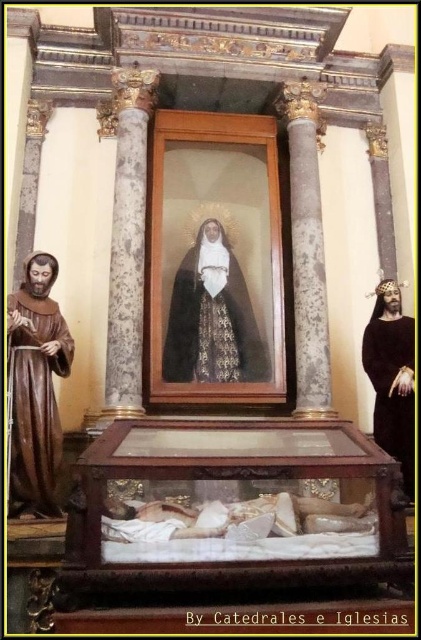
Question: Estimate the real-world distances between objects in this image. Which object is closer to the wooden sarcophagus at center?

Choices:
 (A) black velvet robe at right
 (B) black velvet robe at center
 (C) brown wooden statue at left

Answer: (A)

Question: Which of these objects is positioned closest to the wooden sarcophagus at center?

Choices:
 (A) black velvet robe at right
 (B) brown wooden statue at left
 (C) black velvet robe at center

Answer: (A)

Question: From the image, what is the correct spatial relationship of wooden sarcophagus at center in relation to brown wooden statue at left?

Choices:
 (A) below
 (B) above

Answer: (A)

Question: Can you confirm if black velvet robe at center is smaller than brown wooden statue at left?

Choices:
 (A) yes
 (B) no

Answer: (B)

Question: Which object is positioned closest to the black velvet robe at right?

Choices:
 (A) brown wooden statue at left
 (B) black velvet robe at center
 (C) wooden sarcophagus at center

Answer: (C)

Question: Is wooden sarcophagus at center bigger than black velvet robe at center?

Choices:
 (A) no
 (B) yes

Answer: (B)